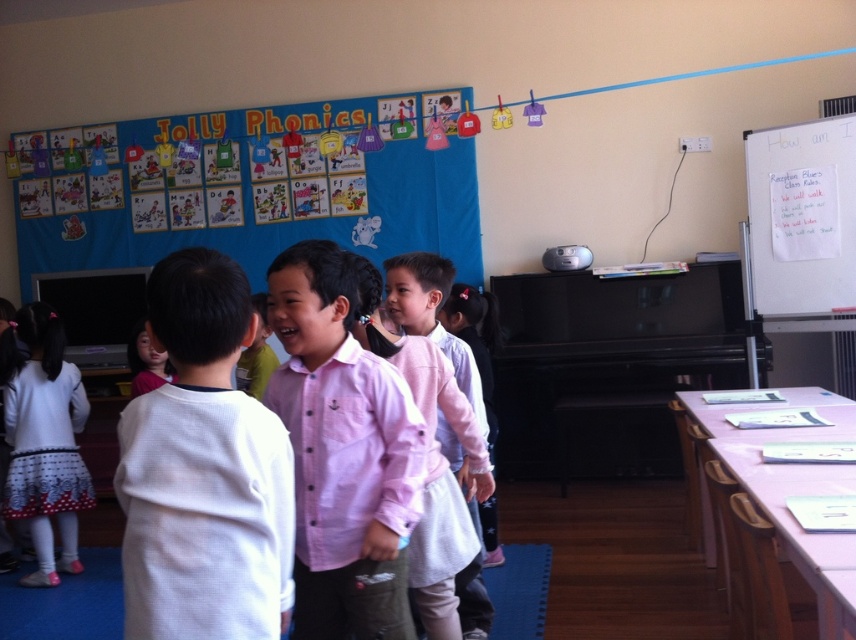
Question: Can you confirm if white matte shirt at center is positioned to the right of white dotted dress at lower left?

Choices:
 (A) no
 (B) yes

Answer: (B)

Question: Which point is farther to the camera?

Choices:
 (A) white paper at upper right
 (B) white matte shirt at center

Answer: (A)

Question: In this image, where is white paper at upper right located relative to pink cotton shirt at center?

Choices:
 (A) left
 (B) right

Answer: (B)

Question: Which object appears farthest from the camera in this image?

Choices:
 (A) pink button-down shirt at center
 (B) pink cotton shirt at center
 (C) white dotted dress at lower left
 (D) white paper at upper right

Answer: (D)

Question: Which object is positioned closest to the pink button-down shirt at center?

Choices:
 (A) white paper at upper right
 (B) white dotted dress at lower left

Answer: (B)

Question: Is white paper at upper right to the right of pink cotton shirt at center from the viewer's perspective?

Choices:
 (A) yes
 (B) no

Answer: (A)